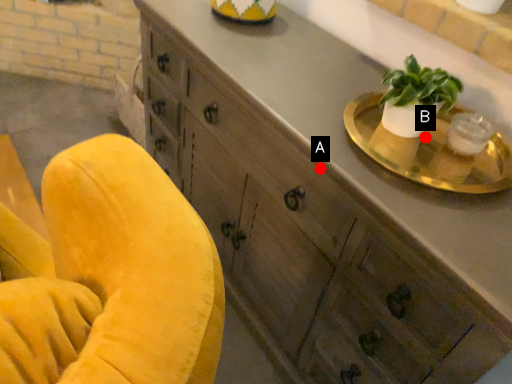
Question: Two points are circled on the image, labeled by A and B beside each circle. Which point is further to the camera?

Choices:
 (A) A is further
 (B) B is further

Answer: (B)